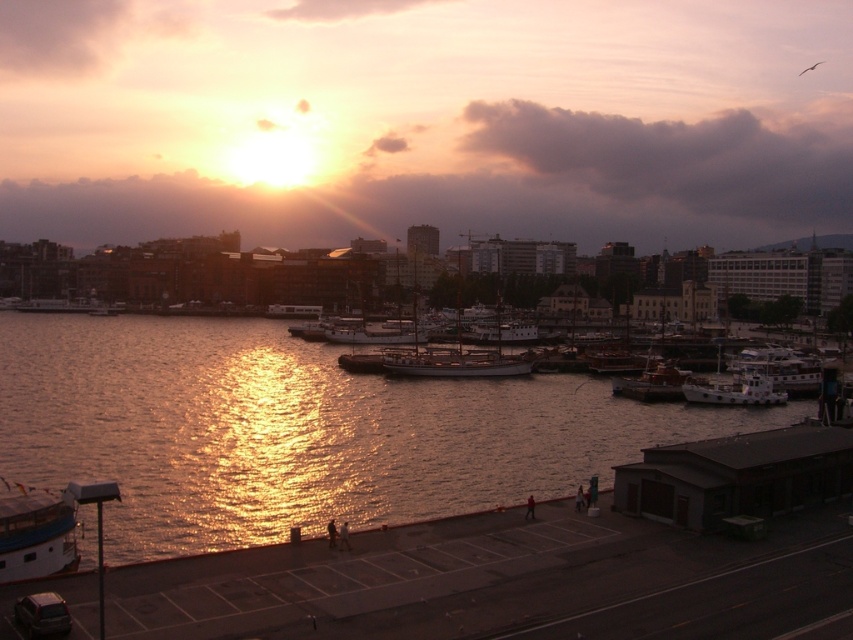
You are a photographer planning to capture the sunset reflection on the water. You have a camera with a wide angle lens that can capture large areas. Which object between the shiny golden water at center and the white wooden boat at center right would be better suited for your shot?

The shiny golden water at center is larger in size than the white wooden boat at center right, making it better suited for capturing the sunset reflection with a wide angle lens.

You are a harbor worker who needs to tow the smaller boat. Which boat should you choose between the white glossy boat at lower left and the white wooden boat at center right?

The white glossy boat at lower left has a smaller size compared to the white wooden boat at center right, so you should choose the white glossy boat at lower left for towing.

You are standing at the edge of the harbor and see two points in the water. The first point is at coordinates point [701,490] and the second point is at point [688,392]. Which point is closer to you?

Point [701,490] is in front of point [688,392], so it is closer to you.